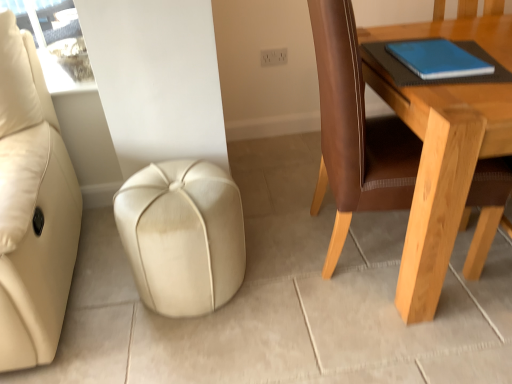
Question: From the image's perspective, would you say blue matte notebook at upper right is shown under light brown wooden table at right?

Choices:
 (A) yes
 (B) no

Answer: (B)

Question: Is the depth of blue matte notebook at upper right greater than that of light brown wooden table at right?

Choices:
 (A) yes
 (B) no

Answer: (A)

Question: From a real-world perspective, is blue matte notebook at upper right physically above light brown wooden table at right?

Choices:
 (A) no
 (B) yes

Answer: (B)

Question: Does blue matte notebook at upper right have a smaller size compared to light brown wooden table at right?

Choices:
 (A) no
 (B) yes

Answer: (B)

Question: Considering the relative sizes of blue matte notebook at upper right and light brown wooden table at right in the image provided, is blue matte notebook at upper right wider than light brown wooden table at right?

Choices:
 (A) yes
 (B) no

Answer: (B)

Question: Could you tell me if blue matte notebook at upper right is facing light brown wooden table at right?

Choices:
 (A) yes
 (B) no

Answer: (B)

Question: Is light brown wooden table at right aimed at beige leather ottoman at center?

Choices:
 (A) yes
 (B) no

Answer: (B)

Question: Does light brown wooden table at right appear on the right side of beige leather ottoman at center?

Choices:
 (A) yes
 (B) no

Answer: (A)

Question: Can you confirm if light brown wooden table at right is thinner than beige leather ottoman at center?

Choices:
 (A) yes
 (B) no

Answer: (B)

Question: Is light brown wooden table at right to the left of beige leather ottoman at center from the viewer's perspective?

Choices:
 (A) yes
 (B) no

Answer: (B)

Question: Is light brown wooden table at right outside beige leather ottoman at center?

Choices:
 (A) yes
 (B) no

Answer: (A)

Question: Considering the relative sizes of light brown wooden table at right and beige leather ottoman at center in the image provided, is light brown wooden table at right taller than beige leather ottoman at center?

Choices:
 (A) yes
 (B) no

Answer: (A)

Question: Is blue matte notebook at upper right located within beige leather ottoman at center?

Choices:
 (A) no
 (B) yes

Answer: (A)